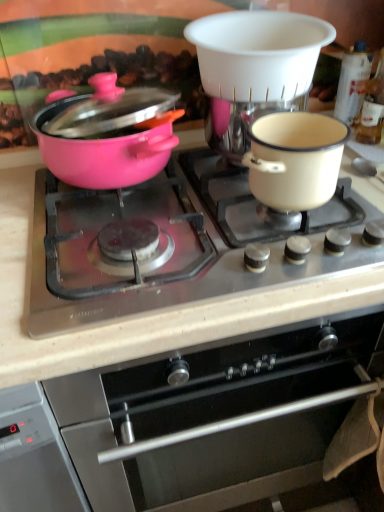
Identify the location of white plastic coffee machine at upper center. This screenshot has width=384, height=512. (254, 68).

Measure the distance between point (288, 135) and camera.

Point (288, 135) and camera are 74.20 centimeters apart.

Measure the distance between matte black cooktop at center and camera.

The depth of matte black cooktop at center is 54.26 centimeters.

Identify the location of pink glossy pot at left. [x=107, y=137].

What do you see at coordinates (216, 420) in the screenshot? This screenshot has width=384, height=512. I see `stainless steel oven at center` at bounding box center [216, 420].

Identify the location of stainless steel oven at center. (x=216, y=420).

Locate an element on the screen. The width and height of the screenshot is (384, 512). white plastic coffee machine at upper center is located at coordinates 254,68.

Can you confirm if pink glossy pot at left is positioned to the right of cream enamel pot at right?

In fact, pink glossy pot at left is to the left of cream enamel pot at right.

Does pink glossy pot at left touch cream enamel pot at right?

No, pink glossy pot at left is not making contact with cream enamel pot at right.

Is pink glossy pot at left wider than cream enamel pot at right?

Yes.

Considering the relative sizes of pink glossy pot at left and cream enamel pot at right in the image provided, is pink glossy pot at left smaller than cream enamel pot at right?

Actually, pink glossy pot at left might be larger than cream enamel pot at right.

Based on the photo, from a real-world perspective, is stainless steel oven at center above or below cream enamel pot at right?

Clearly, from a real-world perspective, stainless steel oven at center is below cream enamel pot at right.

What's the angular difference between stainless steel oven at center and cream enamel pot at right's facing directions?

0.00196 degrees.

Is stainless steel oven at center placed right next to cream enamel pot at right?

No, stainless steel oven at center is not beside cream enamel pot at right.

Is stainless steel oven at center smaller than cream enamel pot at right?

No.

From a real-world perspective, between stainless steel oven at center and white plastic coffee machine at upper center, who is vertically higher?

In real-world perspective, white plastic coffee machine at upper center is above.

From the image's perspective, is stainless steel oven at center on top of white plastic coffee machine at upper center?

No.

Measure the distance between stainless steel oven at center and white plastic coffee machine at upper center.

The distance of stainless steel oven at center from white plastic coffee machine at upper center is 20.37 inches.

Which object is closer to the camera, stainless steel oven at center or white plastic coffee machine at upper center?

stainless steel oven at center.

Is point (264, 61) less distant than point (107, 120)?

Yes.

Locate an element on the screen. This screenshot has width=384, height=512. pot/pan above the white plastic coffee machine at upper center (from a real-world perspective) is located at coordinates pyautogui.click(x=107, y=137).

Is pink glossy pot at left at the back of white plastic coffee machine at upper center?

No, white plastic coffee machine at upper center is not facing away from pink glossy pot at left.

Who is shorter, white plastic coffee machine at upper center or pink glossy pot at left?

white plastic coffee machine at upper center.

Which is more to the left, cream enamel pot at right or pink glossy pot at left?

From the viewer's perspective, pink glossy pot at left appears more on the left side.

From the image's perspective, between cream enamel pot at right and pink glossy pot at left, which one is located above?

pink glossy pot at left, from the image's perspective.

Would you say cream enamel pot at right contains pink glossy pot at left?

No.

I want to click on bowl that is on the right side of pink glossy pot at left, so click(295, 159).

Looking at their sizes, would you say matte black cooktop at center is wider or thinner than white plastic coffee machine at upper center?

Considering their sizes, matte black cooktop at center looks broader than white plastic coffee machine at upper center.

Considering the relative sizes of matte black cooktop at center and white plastic coffee machine at upper center in the image provided, is matte black cooktop at center taller than white plastic coffee machine at upper center?

In fact, matte black cooktop at center may be shorter than white plastic coffee machine at upper center.

From a real-world perspective, is matte black cooktop at center over white plastic coffee machine at upper center?

Actually, matte black cooktop at center is physically below white plastic coffee machine at upper center in the real world.

Is matte black cooktop at center smaller than white plastic coffee machine at upper center?

Incorrect, matte black cooktop at center is not smaller in size than white plastic coffee machine at upper center.

Which of these two, matte black cooktop at center or cream enamel pot at right, stands taller?

With more height is cream enamel pot at right.

From the image's perspective, which one is positioned lower, matte black cooktop at center or cream enamel pot at right?

matte black cooktop at center.

How many degrees apart are the facing directions of matte black cooktop at center and cream enamel pot at right?

0.00158 degrees separate the facing orientations of matte black cooktop at center and cream enamel pot at right.

Considering the sizes of matte black cooktop at center and cream enamel pot at right in the image, is matte black cooktop at center bigger or smaller than cream enamel pot at right?

Considering their sizes, matte black cooktop at center takes up more space than cream enamel pot at right.

There is a cream enamel pot at right. Identify the location of pot/pan above it (from a real-world perspective). The image size is (384, 512). (107, 137).

Locate an element on the screen. oven on the left of the cream enamel pot at right is located at coordinates (216, 420).

From the image, which object appears to be farther from white plastic coffee machine at upper center, pink glossy pot at left or matte black cooktop at center?

Among the two, matte black cooktop at center is located further to white plastic coffee machine at upper center.

Which object lies nearer to the anchor point matte black cooktop at center, white plastic coffee machine at upper center or stainless steel oven at center?

white plastic coffee machine at upper center.

Based on their spatial positions, is matte black cooktop at center or pink glossy pot at left closer to cream enamel pot at right?

Based on the image, matte black cooktop at center appears to be nearer to cream enamel pot at right.

Estimate the real-world distances between objects in this image. Which object is closer to pink glossy pot at left, white plastic coffee machine at upper center or matte black cooktop at center?

Among the two, matte black cooktop at center is located nearer to pink glossy pot at left.

Looking at the image, which one is located further to white plastic coffee machine at upper center, pink glossy pot at left or stainless steel oven at center?

stainless steel oven at center is further to white plastic coffee machine at upper center.

Which object lies nearer to the anchor point pink glossy pot at left, white plastic coffee machine at upper center or cream enamel pot at right?

white plastic coffee machine at upper center is positioned closer to the anchor pink glossy pot at left.

From the image, which object appears to be farther from stainless steel oven at center, pink glossy pot at left or cream enamel pot at right?

Based on the image, pink glossy pot at left appears to be further to stainless steel oven at center.

Considering their positions, is matte black cooktop at center positioned closer to stainless steel oven at center than cream enamel pot at right?

matte black cooktop at center is closer to stainless steel oven at center.

The width and height of the screenshot is (384, 512). In order to click on coffee machine situated between pink glossy pot at left and cream enamel pot at right from left to right in this screenshot , I will do `click(254, 68)`.

Where is `gas stove between pink glossy pot at left and stainless steel oven at center from top to bottom`? gas stove between pink glossy pot at left and stainless steel oven at center from top to bottom is located at coordinates (162, 256).

The image size is (384, 512). I want to click on gas stove that lies between white plastic coffee machine at upper center and stainless steel oven at center from top to bottom, so click(x=162, y=256).

Where is `gas stove that lies between cream enamel pot at right and stainless steel oven at center from top to bottom`? The height and width of the screenshot is (512, 384). gas stove that lies between cream enamel pot at right and stainless steel oven at center from top to bottom is located at coordinates point(162,256).